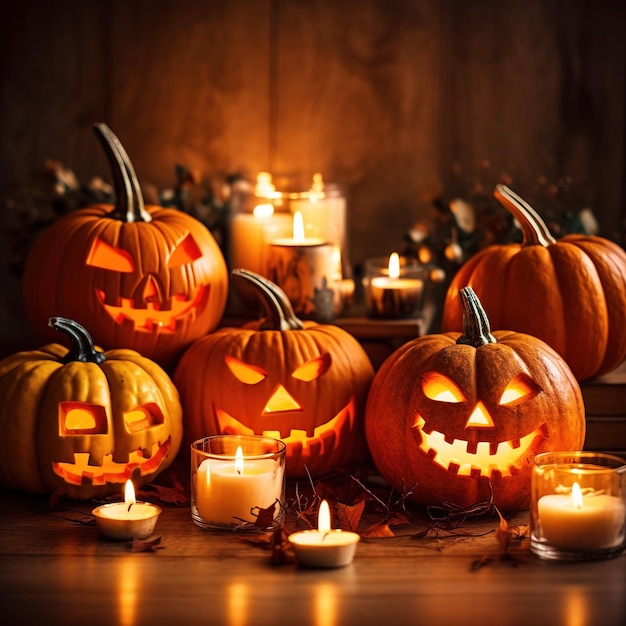
Find the location of a particular element. The height and width of the screenshot is (626, 626). table is located at coordinates (413, 587).